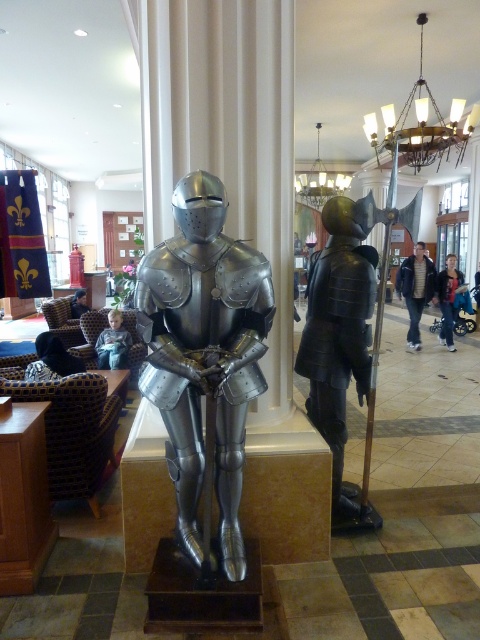
You are standing in the lobby and need to move from the shiny black armor at center to the light brown leather jacket at center. Which direction should you move?

You should move to the left because the shiny black armor at center is to the right of the light brown leather jacket at center.

You are standing in the lobby and need to locate the shiny black armor at center. According to the coordinates provided, where exactly is it positioned?

The shiny black armor at center is located at the 2D coordinates point (339,346).

Consider the image. You are standing in the lobby and want to reach the point marked at coordinates point (348, 528). If you walk straight ahead, will you reach that point before the knight on the left? Please explain your reasoning.

The point marked at coordinates point (348, 528) is 9.39 feet away from the viewer. Since the knight on the left is part of the foreground and closer to the viewer than the point, you would reach the knight on the left before reaching the point (348, 528).